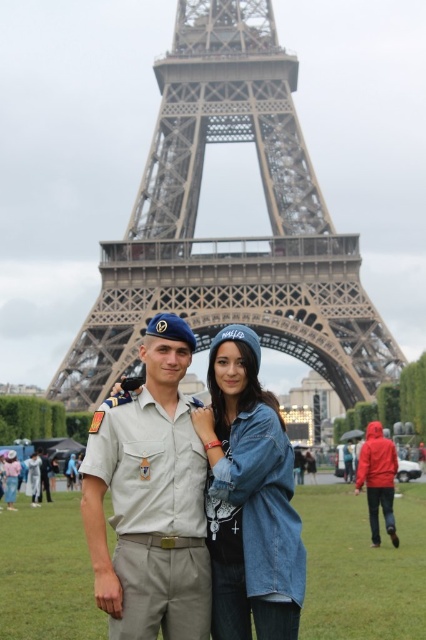
Who is shorter, light beige uniform at center or denim jacket at center?

Standing shorter between the two is denim jacket at center.

Who is more distant from viewer, (178, 554) or (230, 480)?

Point (178, 554)

What are the coordinates of `light beige uniform at center` in the screenshot? It's located at (149, 499).

Who is higher up, light beige uniform at center or matte red jacket at center?

light beige uniform at center is above.

Is light beige uniform at center bigger than matte red jacket at center?

Indeed, light beige uniform at center has a larger size compared to matte red jacket at center.

Is point (201, 600) in front of point (391, 452)?

Yes, it is.

You are a GUI agent. You are given a task and a screenshot of the screen. Output one action in this format:
    pyautogui.click(x=<x>, y=<y>)
    Task: Click on the light beige uniform at center
    The image size is (426, 640).
    Given the screenshot: What is the action you would take?
    pyautogui.click(x=149, y=499)

Between metallic structure at center and matte red jacket at center, which one has more height?

metallic structure at center is taller.

Is metallic structure at center below matte red jacket at center?

No.

I want to click on metallic structure at center, so click(236, 237).

Identify the location of metallic structure at center. Image resolution: width=426 pixels, height=640 pixels. (236, 237).